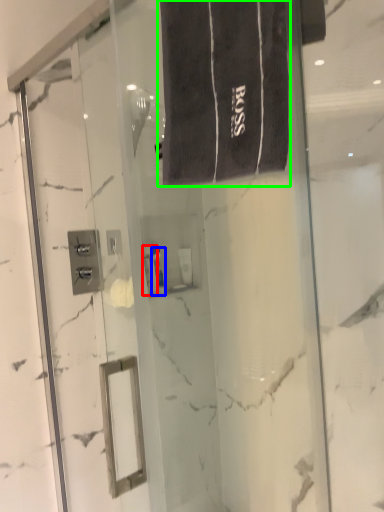
Question: Which object is positioned closest to toiletry (highlighted by a red box)? Select from toiletry (highlighted by a blue box) and bath towel (highlighted by a green box).

Choices:
 (A) toiletry
 (B) bath towel

Answer: (A)